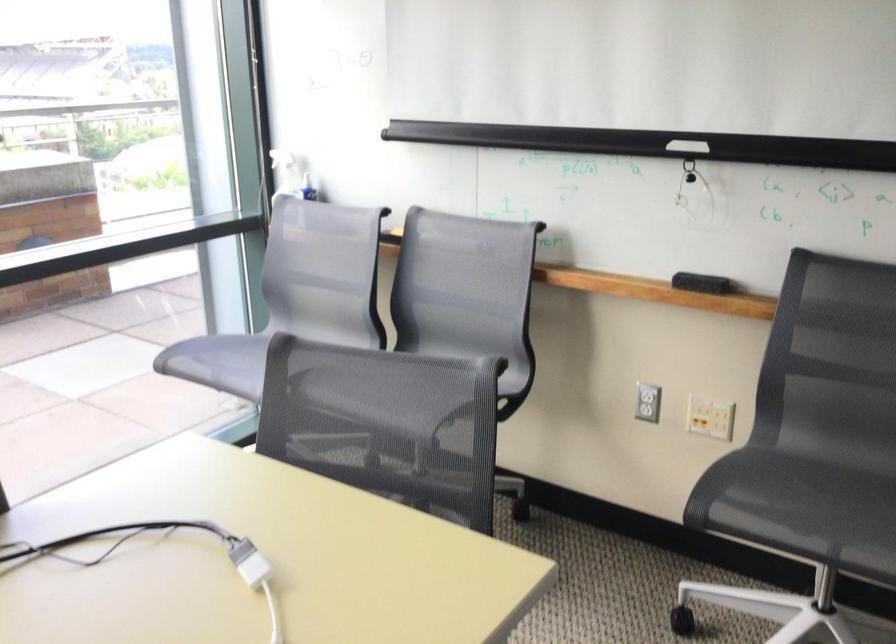
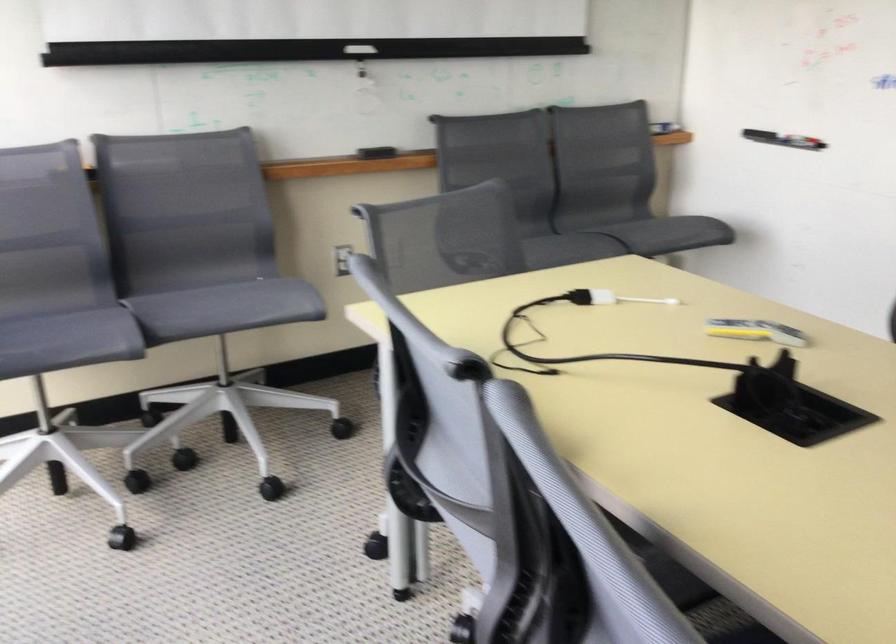
Locate, in the second image, the point that corresponds to [805,509] in the first image.

(538, 247)